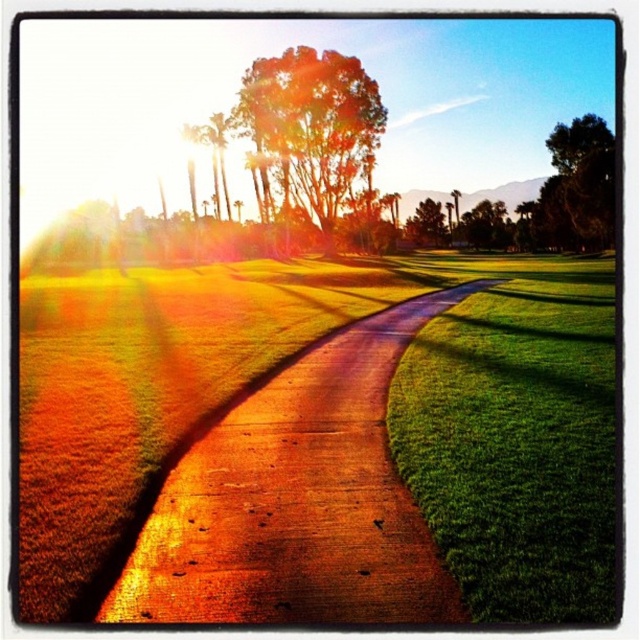
Question: Which point is closer to the camera?

Choices:
 (A) dirt track at center
 (B) green leafy trees at upper center

Answer: (A)

Question: Among these points, which one is nearest to the camera?

Choices:
 (A) (339, 172)
 (B) (196, 132)
 (C) (612, 566)

Answer: (C)

Question: Does green leafy tree at upper center come in front of green leafy tree at upper right?

Choices:
 (A) no
 (B) yes

Answer: (A)

Question: Is green leafy tree at upper center thinner than green leafy trees at upper center?

Choices:
 (A) no
 (B) yes

Answer: (A)

Question: Is green leafy tree at upper center thinner than green leafy tree at center?

Choices:
 (A) yes
 (B) no

Answer: (B)

Question: Estimate the real-world distances between objects in this image. Which object is closer to the green leafy tree at upper right?

Choices:
 (A) green leafy tree at center
 (B) green leafy tree at upper center
 (C) dirt track at center

Answer: (A)